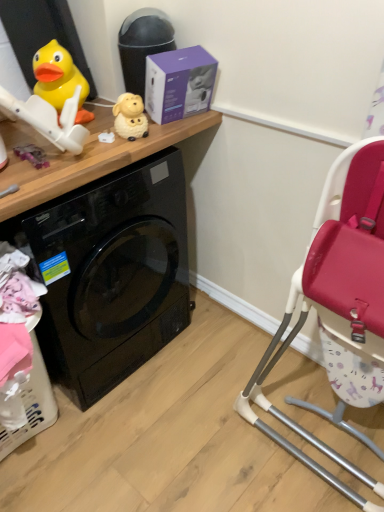
Image resolution: width=384 pixels, height=512 pixels. I want to click on vacant space in front of purple fabric toy at left, the 3th toy from the right, so click(29, 177).